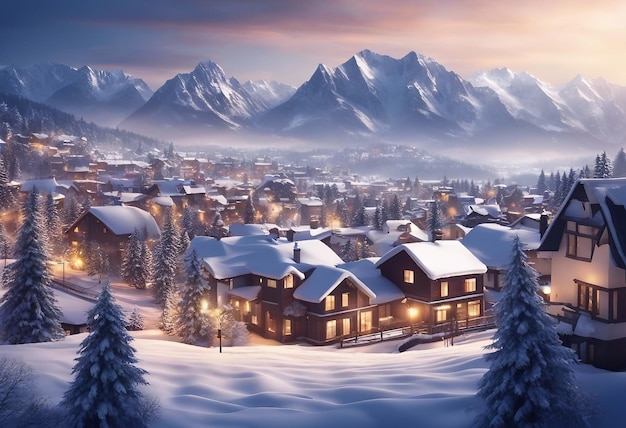
The image size is (626, 428). Identify the location of chimney. (300, 263), (404, 244), (438, 206).